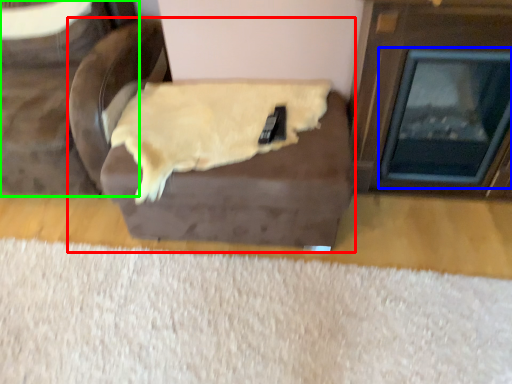
Question: Considering the real-world distances, which object is farthest from furniture (highlighted by a red box)? fireplace (highlighted by a blue box) or furniture (highlighted by a green box)?

Choices:
 (A) fireplace
 (B) furniture

Answer: (A)